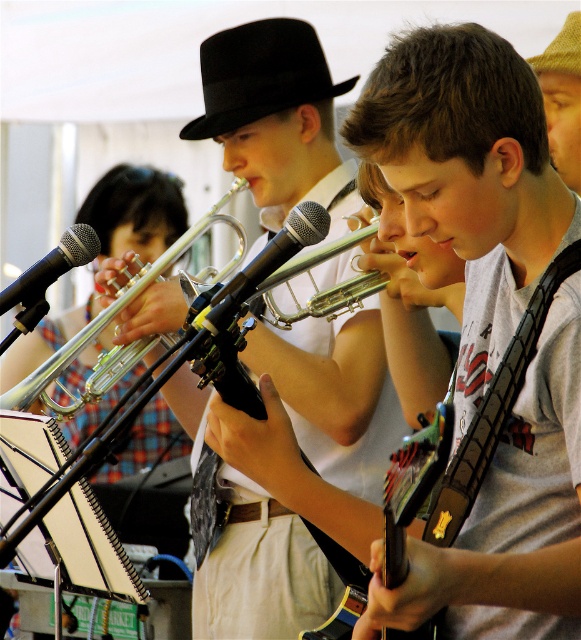
Question: Is shiny silver trumpet at center bigger than black metallic microphone at left?

Choices:
 (A) no
 (B) yes

Answer: (B)

Question: Which point is closer to the camera?

Choices:
 (A) (30, 275)
 (B) (112, 305)
 (C) (368, 294)
 (D) (249, 33)

Answer: (A)

Question: Can you confirm if silver shiny trumpet at center is positioned to the right of silver metallic microphone at center?

Choices:
 (A) no
 (B) yes

Answer: (A)

Question: Considering the real-world distances, which object is farthest from the silver shiny trumpet at center?

Choices:
 (A) silver/metallic trumpet at center
 (B) silver metallic microphone at center
 (C) matte black guitar at center

Answer: (C)

Question: Is black felt fedora at upper center further to the viewer compared to silver/metallic trumpet at center?

Choices:
 (A) yes
 (B) no

Answer: (A)

Question: Among these objects, which one is nearest to the camera?

Choices:
 (A) black felt fedora at upper center
 (B) black metallic microphone at left
 (C) silver shiny trumpet at center
 (D) black felt hat at upper center

Answer: (B)